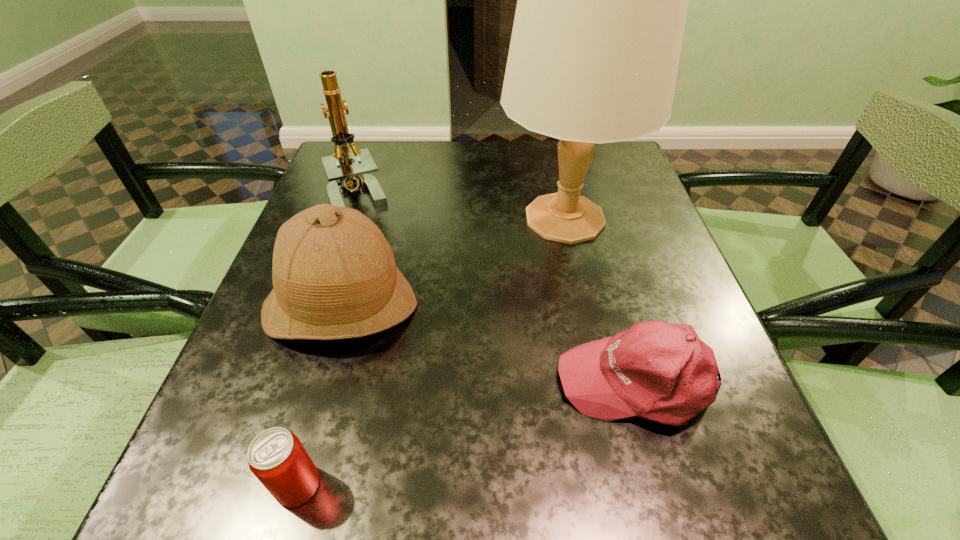
At what (x,y) coordinates should I click in order to perform the action: click on object that is positioned at the far left corner. Please return your answer as a coordinate pair (x, y). The image size is (960, 540). Looking at the image, I should click on (344, 175).

Where is `object that is positioned at the near left corner`? The height and width of the screenshot is (540, 960). object that is positioned at the near left corner is located at coordinates (277, 458).

Locate an element on the screen. object that is positioned at the far right corner is located at coordinates (602, 0).

In the image, there is a desktop. Identify the location of vacant area at the far edge. (427, 148).

You are a GUI agent. You are given a task and a screenshot of the screen. Output one action in this format:
    pyautogui.click(x=<x>, y=<y>)
    Task: Click on the vacant region at the near edge of the desktop
    The width and height of the screenshot is (960, 540).
    Given the screenshot: What is the action you would take?
    pyautogui.click(x=616, y=509)

This screenshot has height=540, width=960. I want to click on free space at the right edge of the desktop, so click(x=728, y=399).

Locate an element on the screen. Image resolution: width=960 pixels, height=540 pixels. free spot at the far left corner of the desktop is located at coordinates (389, 152).

This screenshot has width=960, height=540. Find the location of `vacant region at the far right corner of the desktop`. vacant region at the far right corner of the desktop is located at coordinates (614, 183).

Locate an element on the screen. The height and width of the screenshot is (540, 960). empty location between the third tallest object and the baseball cap is located at coordinates (490, 344).

Locate an element on the screen. The image size is (960, 540). empty space between the nearest object and the baseball cap is located at coordinates (468, 433).